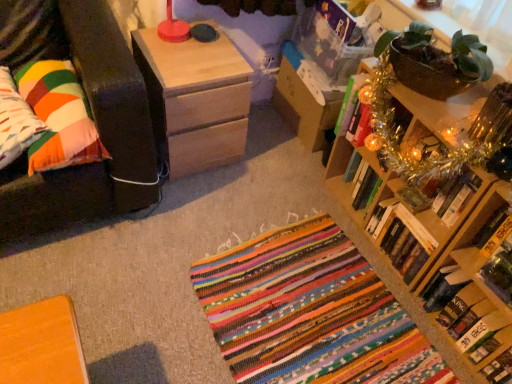
Where is `free space that is to the left of multicolored woven rug at center`? The image size is (512, 384). free space that is to the left of multicolored woven rug at center is located at coordinates (147, 280).